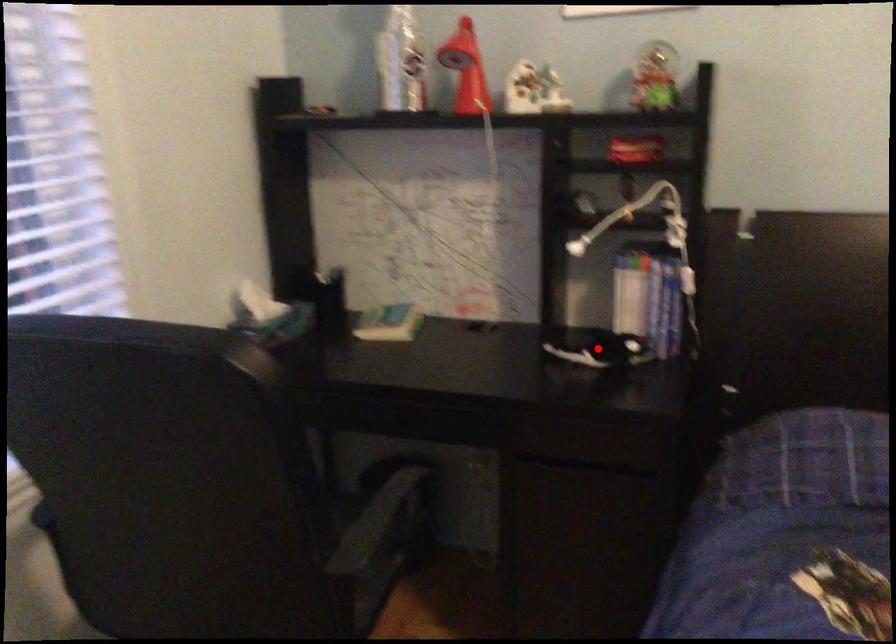
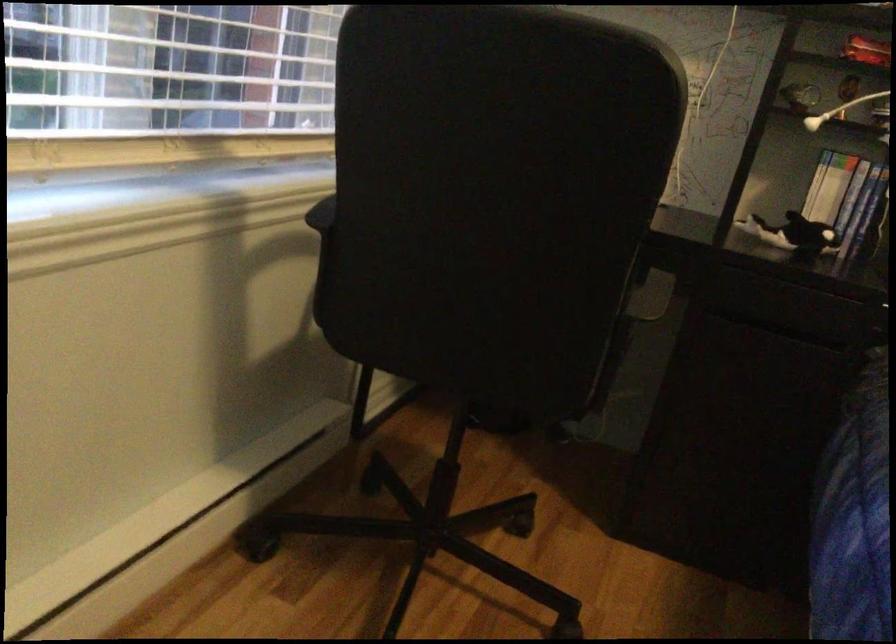
Where in the second image is the point corresponding to the highlighted location from the first image?

(793, 234)